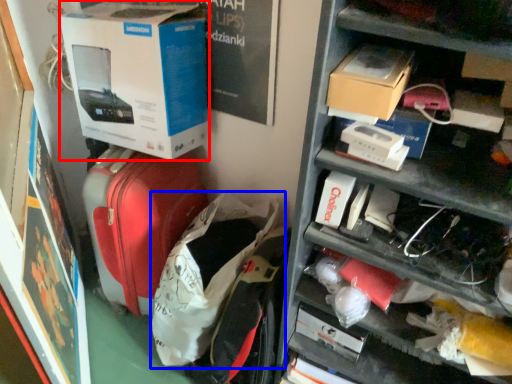
Question: Which object appears farthest to the camera in this image, box (highlighted by a red box) or luggage (highlighted by a blue box)?

Choices:
 (A) box
 (B) luggage

Answer: (A)